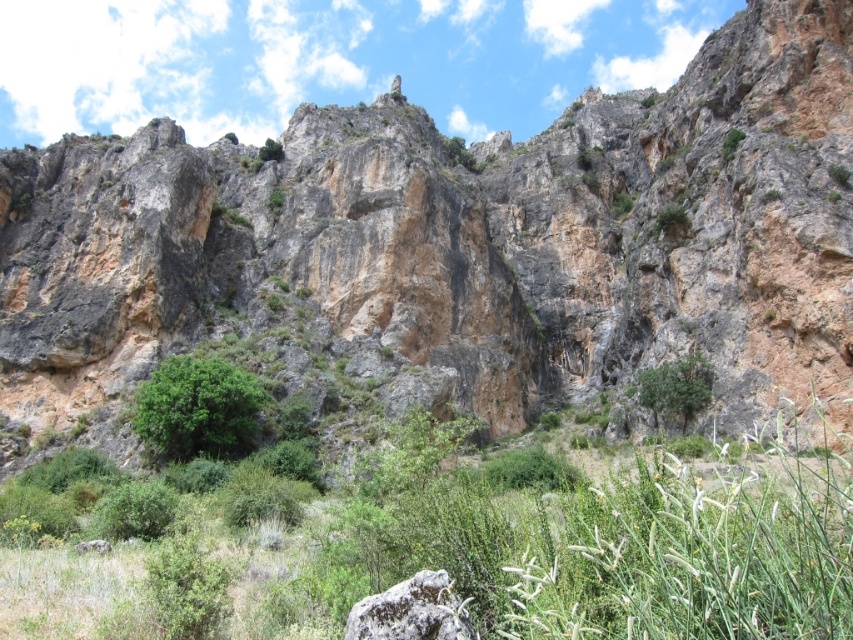
Question: Estimate the real-world distances between objects in this image. Which object is closer to the rough textured rock at center?

Choices:
 (A) green leafy bush at center
 (B) green leafy shrub at center-right

Answer: (A)

Question: Can you confirm if rough textured rock at center is smaller than green leafy shrub at center-right?

Choices:
 (A) no
 (B) yes

Answer: (B)

Question: Is green leafy bush at center below rough textured rock at center?

Choices:
 (A) yes
 (B) no

Answer: (B)

Question: Estimate the real-world distances between objects in this image. Which object is closer to the green leafy bush at center?

Choices:
 (A) green leafy shrub at center-right
 (B) rough textured rock at center

Answer: (A)

Question: Which of these objects is positioned closest to the rough textured rock at center?

Choices:
 (A) green leafy bush at center
 (B) green leafy shrub at center-right

Answer: (A)

Question: From the image, what is the correct spatial relationship of green leafy bush at center in relation to rough textured rock at center?

Choices:
 (A) below
 (B) above

Answer: (B)